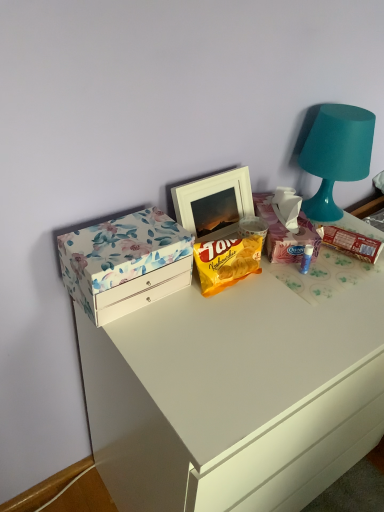
Question: Does brown cardboard snack at right, marked as the second snack in a left-to-right arrangement, touch teal matte lamp at upper right?

Choices:
 (A) no
 (B) yes

Answer: (A)

Question: From the image's perspective, is brown cardboard snack at right, which ranks as the 1th snack in right-to-left order, on top of teal matte lamp at upper right?

Choices:
 (A) yes
 (B) no

Answer: (B)

Question: Would you say brown cardboard snack at right, which ranks as the 1th snack in right-to-left order, contains teal matte lamp at upper right?

Choices:
 (A) no
 (B) yes

Answer: (A)

Question: Considering the relative sizes of brown cardboard snack at right, marked as the second snack in a left-to-right arrangement, and teal matte lamp at upper right in the image provided, is brown cardboard snack at right, marked as the second snack in a left-to-right arrangement, shorter than teal matte lamp at upper right?

Choices:
 (A) yes
 (B) no

Answer: (A)

Question: Is brown cardboard snack at right, which ranks as the 1th snack in right-to-left order, taller than teal matte lamp at upper right?

Choices:
 (A) yes
 (B) no

Answer: (B)

Question: Considering the relative sizes of brown cardboard snack at right, which ranks as the 1th snack in right-to-left order, and teal matte lamp at upper right in the image provided, is brown cardboard snack at right, which ranks as the 1th snack in right-to-left order, smaller than teal matte lamp at upper right?

Choices:
 (A) no
 (B) yes

Answer: (B)

Question: Are yellow matte snack packet at center, which is counted as the second snack, starting from the right, and white glossy drawer at upper left making contact?

Choices:
 (A) no
 (B) yes

Answer: (A)

Question: Does yellow matte snack packet at center, the first snack when ordered from left to right, have a larger size compared to white glossy drawer at upper left?

Choices:
 (A) yes
 (B) no

Answer: (B)

Question: Considering the relative sizes of yellow matte snack packet at center, which is counted as the second snack, starting from the right, and white glossy drawer at upper left in the image provided, is yellow matte snack packet at center, which is counted as the second snack, starting from the right, shorter than white glossy drawer at upper left?

Choices:
 (A) yes
 (B) no

Answer: (A)

Question: From the image's perspective, is yellow matte snack packet at center, the first snack when ordered from left to right, above white glossy drawer at upper left?

Choices:
 (A) yes
 (B) no

Answer: (A)

Question: Can you confirm if yellow matte snack packet at center, the first snack when ordered from left to right, is taller than white glossy drawer at upper left?

Choices:
 (A) yes
 (B) no

Answer: (B)

Question: From a real-world perspective, does yellow matte snack packet at center, the first snack when ordered from left to right, stand above white glossy drawer at upper left?

Choices:
 (A) no
 (B) yes

Answer: (B)

Question: Is brown cardboard snack at right, marked as the second snack in a left-to-right arrangement, in contact with floral paper box at left?

Choices:
 (A) no
 (B) yes

Answer: (A)